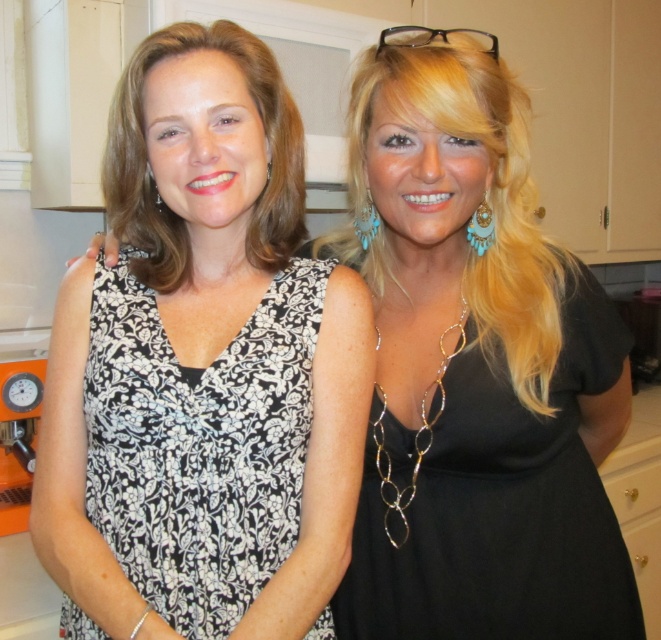
Question: Is black matte dress at right positioned at the back of black floral fabric dress at center?

Choices:
 (A) yes
 (B) no

Answer: (A)

Question: Is black matte dress at right thinner than black floral fabric dress at center?

Choices:
 (A) no
 (B) yes

Answer: (A)

Question: Which of the following is the closest to the observer?

Choices:
 (A) black floral fabric dress at center
 (B) black matte dress at right

Answer: (A)

Question: Is black matte dress at right bigger than black floral fabric dress at center?

Choices:
 (A) no
 (B) yes

Answer: (B)

Question: Among these objects, which one is farthest from the camera?

Choices:
 (A) black floral fabric dress at center
 (B) black matte dress at right

Answer: (B)